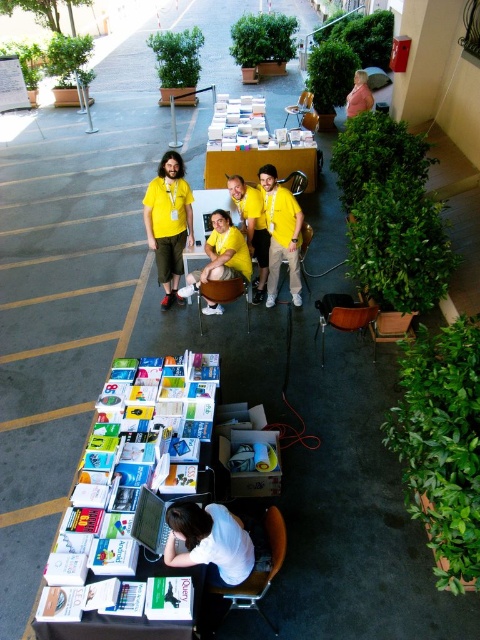
Does white matte shirt at lower center come in front of yellow t-shirt at center?

Yes, white matte shirt at lower center is in front of yellow t-shirt at center.

Which of these two, white matte shirt at lower center or yellow t-shirt at center, stands taller?

yellow t-shirt at center is taller.

Describe the element at coordinates (210, 540) in the screenshot. I see `white matte shirt at lower center` at that location.

Where is `white matte shirt at lower center`? white matte shirt at lower center is located at coordinates (210, 540).

Can you confirm if white paper table at lower left is thinner than matte yellow shirt at center?

No.

Which is more to the left, white paper table at lower left or matte yellow shirt at center?

From the viewer's perspective, matte yellow shirt at center appears more on the left side.

Where is `white paper table at lower left`? This screenshot has width=480, height=640. white paper table at lower left is located at coordinates (121, 509).

At what (x,y) coordinates should I click in order to perform the action: click on white paper table at lower left. Please return your answer as a coordinate pair (x, y). Looking at the image, I should click on (121, 509).

Is yellow fabric shirt at center to the left of pink fabric jacket at upper right from the viewer's perspective?

Indeed, yellow fabric shirt at center is positioned on the left side of pink fabric jacket at upper right.

Is yellow fabric shirt at center further to camera compared to pink fabric jacket at upper right?

No, yellow fabric shirt at center is closer to the viewer.

Does point (233, 228) come closer to viewer compared to point (355, 113)?

Yes, it is.

Locate an element on the screen. This screenshot has height=640, width=480. yellow fabric shirt at center is located at coordinates (220, 256).